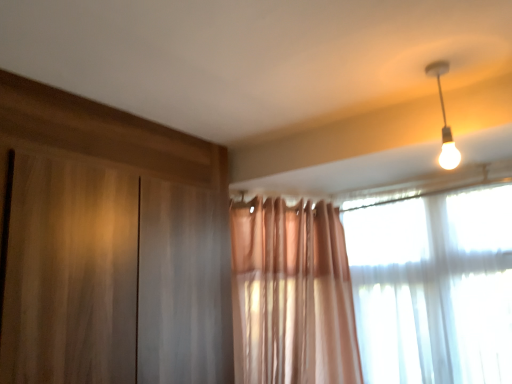
Question: Can you confirm if white glossy bulb at upper right is taller than translucent fabric window at upper right?

Choices:
 (A) no
 (B) yes

Answer: (A)

Question: Is white glossy bulb at upper right shorter than translucent fabric window at upper right?

Choices:
 (A) yes
 (B) no

Answer: (A)

Question: Is white glossy bulb at upper right positioned far away from translucent fabric window at upper right?

Choices:
 (A) yes
 (B) no

Answer: (B)

Question: Can you confirm if white glossy bulb at upper right is thinner than translucent fabric window at upper right?

Choices:
 (A) no
 (B) yes

Answer: (B)

Question: Is white glossy bulb at upper right turned away from translucent fabric window at upper right?

Choices:
 (A) no
 (B) yes

Answer: (A)

Question: From a real-world perspective, is white glossy bulb at upper right located beneath translucent fabric window at upper right?

Choices:
 (A) yes
 (B) no

Answer: (B)

Question: Is translucent fabric window at upper right not within white glossy bulb at upper right?

Choices:
 (A) no
 (B) yes

Answer: (B)

Question: Does translucent fabric window at upper right have a greater height compared to white glossy bulb at upper right?

Choices:
 (A) yes
 (B) no

Answer: (A)

Question: Does translucent fabric window at upper right appear on the left side of white glossy bulb at upper right?

Choices:
 (A) no
 (B) yes

Answer: (A)

Question: Would you say white glossy bulb at upper right is part of translucent fabric window at upper right's contents?

Choices:
 (A) yes
 (B) no

Answer: (B)

Question: From the image's perspective, is translucent fabric window at upper right under white glossy bulb at upper right?

Choices:
 (A) yes
 (B) no

Answer: (A)

Question: Does translucent fabric window at upper right turn towards white glossy bulb at upper right?

Choices:
 (A) yes
 (B) no

Answer: (A)

Question: Do you think translucent fabric window at upper right is within white glossy bulb at upper right, or outside of it?

Choices:
 (A) outside
 (B) inside

Answer: (A)